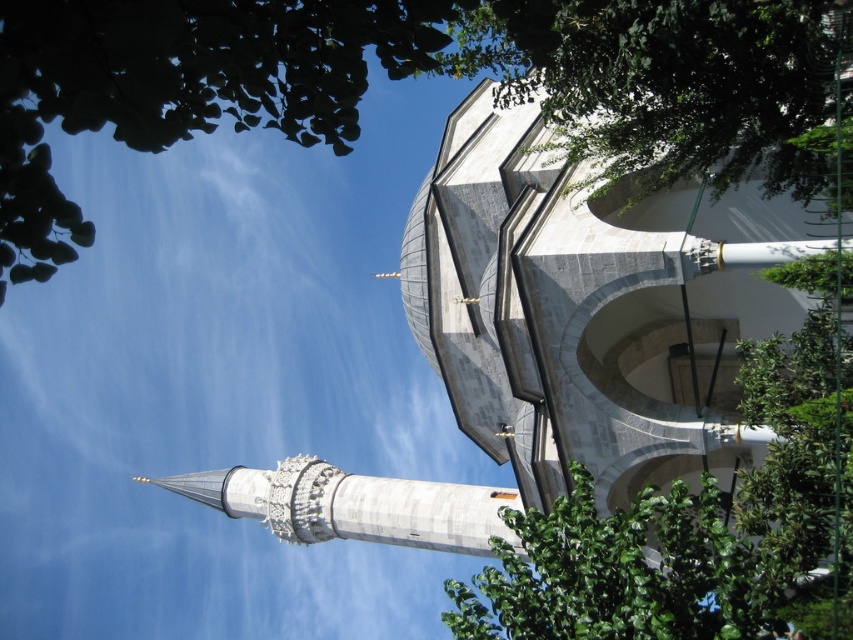
Question: Which point appears closest to the camera in this image?

Choices:
 (A) (503, 509)
 (B) (157, 16)

Answer: (B)

Question: Which object is farther from the camera taking this photo?

Choices:
 (A) green leafy tree at upper center
 (B) green leafy tree at upper left

Answer: (A)

Question: Does green leafy tree at upper left have a smaller size compared to green leafy tree at upper center?

Choices:
 (A) no
 (B) yes

Answer: (A)

Question: Is green leafy tree at upper left thinner than green leafy tree at upper center?

Choices:
 (A) no
 (B) yes

Answer: (A)

Question: Does green leafy tree at upper left have a greater width compared to green leafy tree at upper center?

Choices:
 (A) yes
 (B) no

Answer: (A)